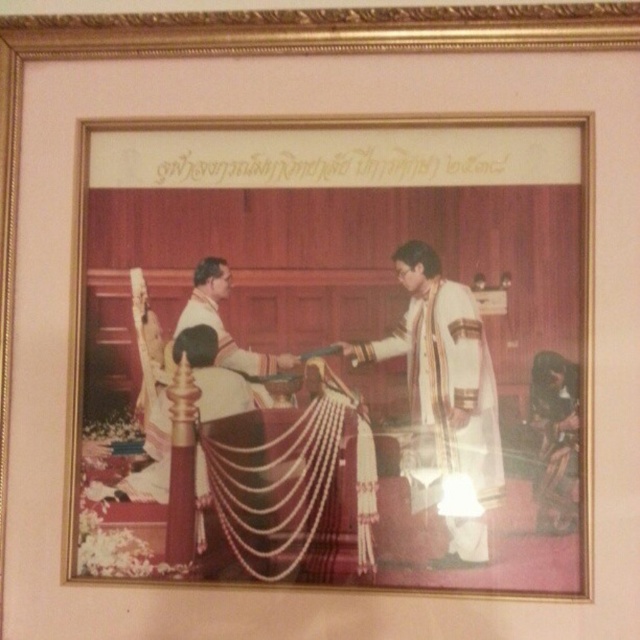
Question: Which object is farther from the camera taking this photo?

Choices:
 (A) white silk robe at center
 (B) matte gold picture frame at center

Answer: (A)

Question: Does matte gold picture frame at center appear over white silk dhoti at center?

Choices:
 (A) yes
 (B) no

Answer: (A)

Question: Does matte gold picture frame at center appear under white silk robe at center?

Choices:
 (A) no
 (B) yes

Answer: (B)

Question: Does matte gold picture frame at center appear over white silk dhoti at center?

Choices:
 (A) no
 (B) yes

Answer: (B)

Question: Which of the following is the farthest from the observer?

Choices:
 (A) (196, 321)
 (B) (80, 442)
 (C) (426, 273)

Answer: (A)

Question: Which of these objects is positioned closest to the white silk dhoti at center?

Choices:
 (A) white silk robe at center
 (B) matte gold picture frame at center

Answer: (B)